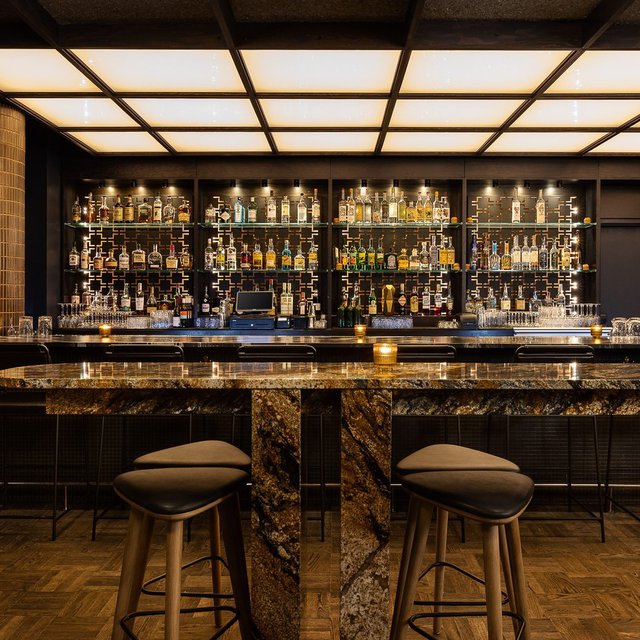
Locate an element on the screen. liquor storage shelving is located at coordinates (52, 288), (47, 173), (209, 164), (417, 164), (614, 169), (614, 207), (612, 290).